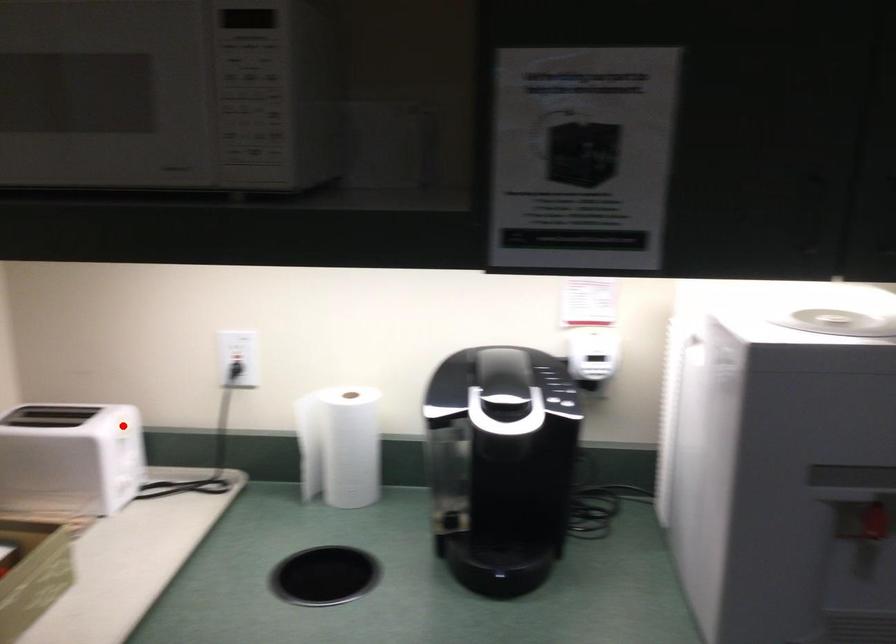
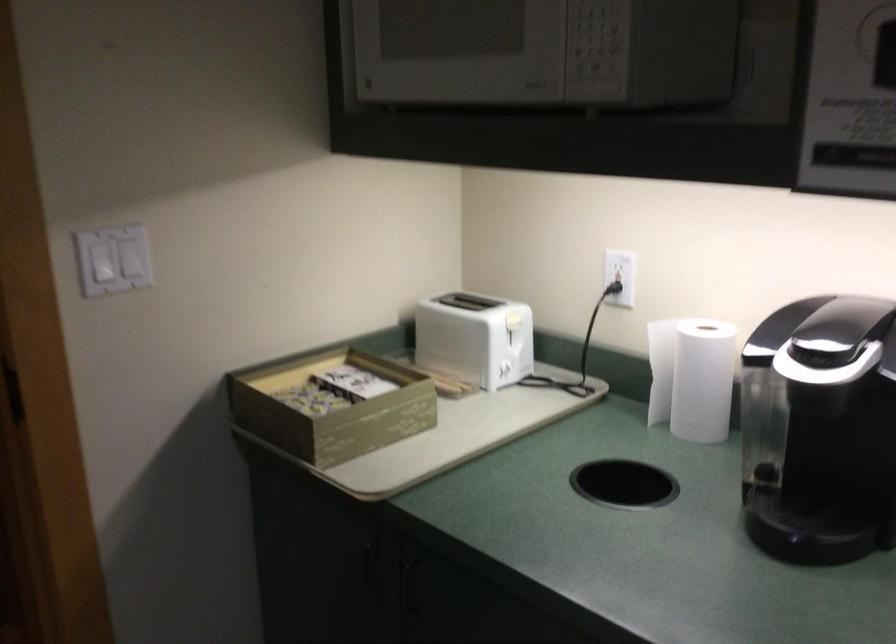
Question: I am providing you with two images of the same scene from different viewpoints. Given a red point in image1, look at the same physical point in image2. Is it:

Choices:
 (A) Closer to the viewpoint
 (B) Farther from the viewpoint

Answer: (B)